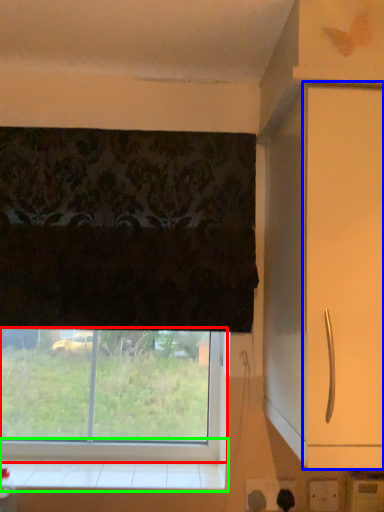
Question: Which is farther away from window (highlighted by a red box)? screen door (highlighted by a blue box) or window sill (highlighted by a green box)?

Choices:
 (A) screen door
 (B) window sill

Answer: (A)